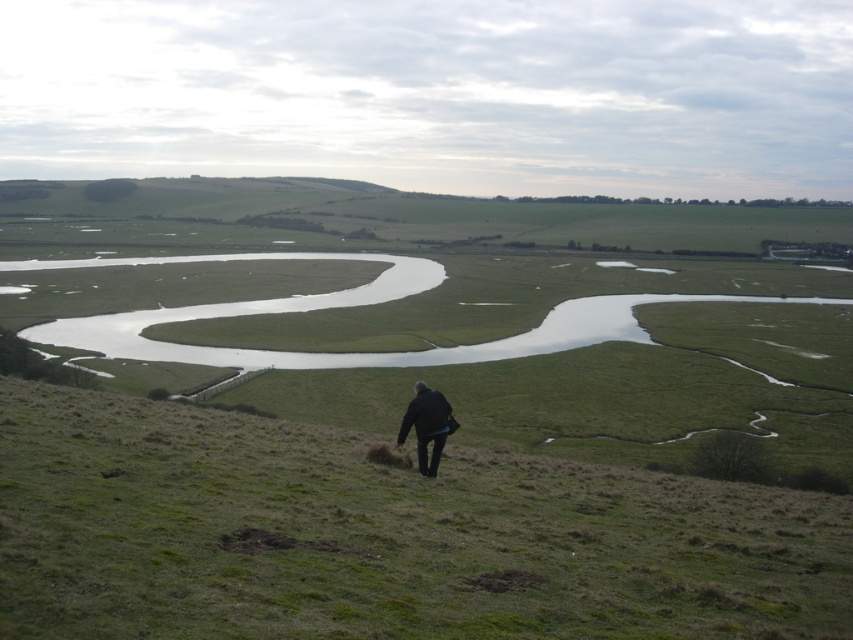
Who is more forward, (167,435) or (422,442)?

Positioned in front is point (422,442).

Who is taller, green grassy hillside at lower center or black matte jacket at center?

With more height is green grassy hillside at lower center.

Between point (714, 508) and point (445, 401), which one is positioned behind?

The point (714, 508) is behind.

Locate an element on the screen. This screenshot has height=640, width=853. green grassy hillside at lower center is located at coordinates (381, 536).